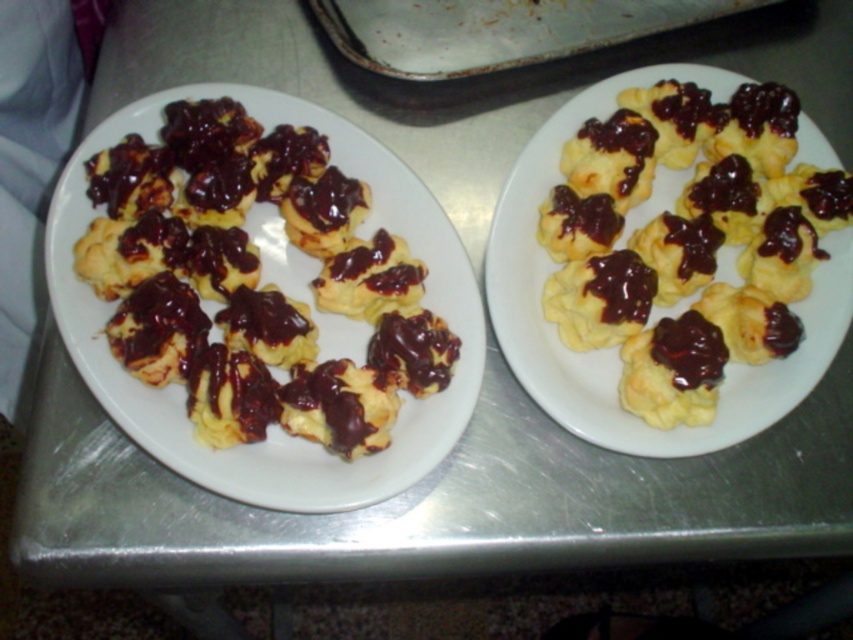
Question: Which point appears farthest from the camera in this image?

Choices:
 (A) (830, 298)
 (B) (285, 497)

Answer: (A)

Question: Can you confirm if matte yellow puff pastries at left is bigger than brushed metal tray at upper center?

Choices:
 (A) no
 (B) yes

Answer: (B)

Question: Is yellow matte puff pastry at center wider than brushed metal tray at upper center?

Choices:
 (A) no
 (B) yes

Answer: (A)

Question: Which object is farther from the camera taking this photo?

Choices:
 (A) yellow matte puff pastry at center
 (B) matte yellow puff pastries at left
 (C) brushed metal tray at upper center

Answer: (C)

Question: Estimate the real-world distances between objects in this image. Which object is closer to the yellow matte puff pastry at center?

Choices:
 (A) matte yellow puff pastries at left
 (B) brushed metal tray at upper center

Answer: (A)

Question: Does matte yellow puff pastries at left come in front of yellow matte puff pastry at center?

Choices:
 (A) yes
 (B) no

Answer: (A)